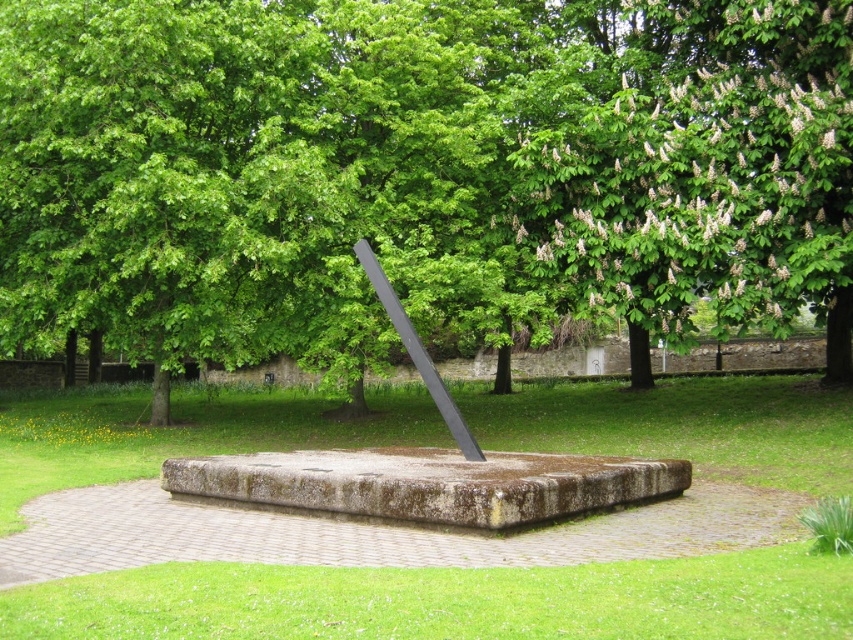
Question: Can you confirm if green leafy tree at center is positioned to the right of black polished metal rod at center?

Choices:
 (A) no
 (B) yes

Answer: (A)

Question: Does green leafy tree at upper right come in front of black polished metal rod at center?

Choices:
 (A) yes
 (B) no

Answer: (B)

Question: Which is nearer to the green leafy tree at center?

Choices:
 (A) black polished metal rod at center
 (B) green leafy tree at upper right
 (C) rusty concrete sundial at center

Answer: (C)

Question: Which point is closer to the camera?

Choices:
 (A) (619, 259)
 (B) (367, 273)
 (C) (482, 291)

Answer: (B)

Question: Can you confirm if green leafy tree at center is smaller than green leafy tree at upper right?

Choices:
 (A) yes
 (B) no

Answer: (B)

Question: Which of the following is the closest to the observer?

Choices:
 (A) (468, 452)
 (B) (49, 83)
 (C) (840, 381)
 (D) (483, 401)

Answer: (A)